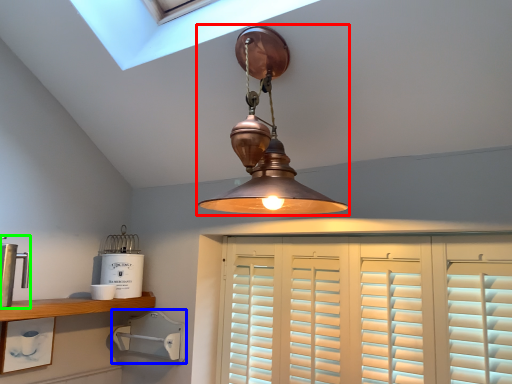
Question: Which is farther away from lamp (highlighted by a red box)? appliance (highlighted by a blue box) or appliance (highlighted by a green box)?

Choices:
 (A) appliance
 (B) appliance

Answer: (B)